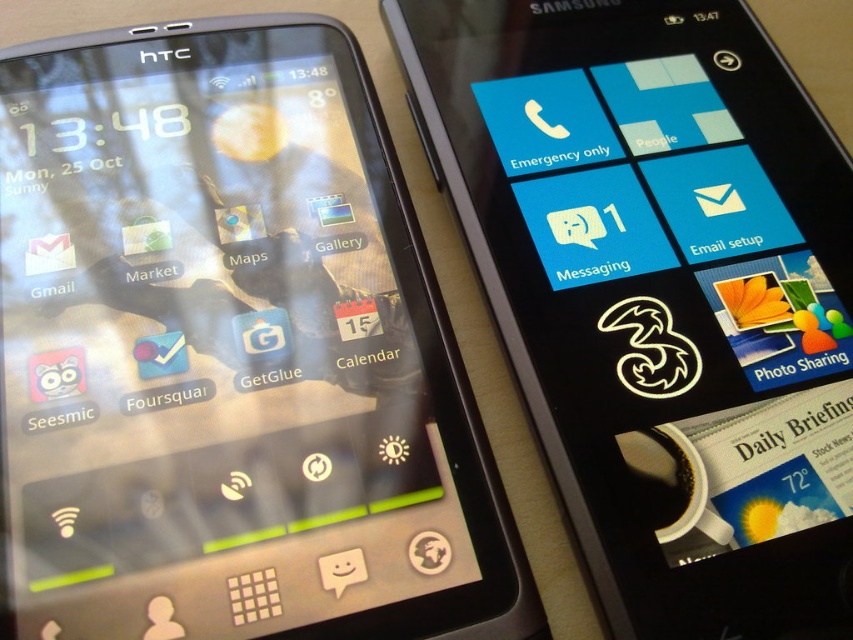
Question: Which point is closer to the camera?

Choices:
 (A) (257, 444)
 (B) (664, 572)

Answer: (B)

Question: Which of the following is the closest to the observer?

Choices:
 (A) matte black phone at left
 (B) black glossy phone at upper left

Answer: (A)

Question: Is matte black phone at left to the right of black glossy phone at upper left from the viewer's perspective?

Choices:
 (A) yes
 (B) no

Answer: (B)

Question: Can you confirm if matte black phone at left is positioned above black glossy phone at upper left?

Choices:
 (A) no
 (B) yes

Answer: (A)

Question: Is matte black phone at left above black glossy phone at upper left?

Choices:
 (A) no
 (B) yes

Answer: (A)